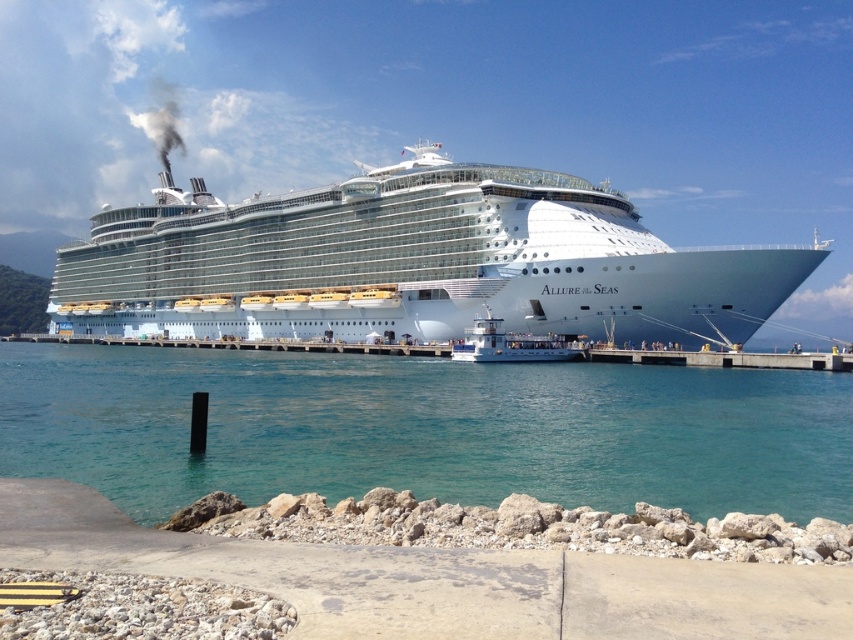
Question: Which object is the closest to the white glossy ferry at center?

Choices:
 (A) gray concrete dock at lower right
 (B) clear blue water at center

Answer: (A)

Question: Which object is positioned farthest from the white glossy cruise ship at center?

Choices:
 (A) gray concrete dock at lower right
 (B) clear blue water at center

Answer: (A)

Question: Is white glossy cruise ship at center to the left of white glossy ferry at center from the viewer's perspective?

Choices:
 (A) no
 (B) yes

Answer: (A)

Question: Which point appears farthest from the camera in this image?

Choices:
 (A) (579, 349)
 (B) (309, 454)
 (C) (590, 188)
 (D) (741, 362)

Answer: (C)

Question: Considering the relative positions of white glossy cruise ship at center and gray concrete dock at lower right in the image provided, where is white glossy cruise ship at center located with respect to gray concrete dock at lower right?

Choices:
 (A) below
 (B) above

Answer: (B)

Question: Does gray concrete dock at lower right have a greater width compared to white glossy ferry at center?

Choices:
 (A) no
 (B) yes

Answer: (B)